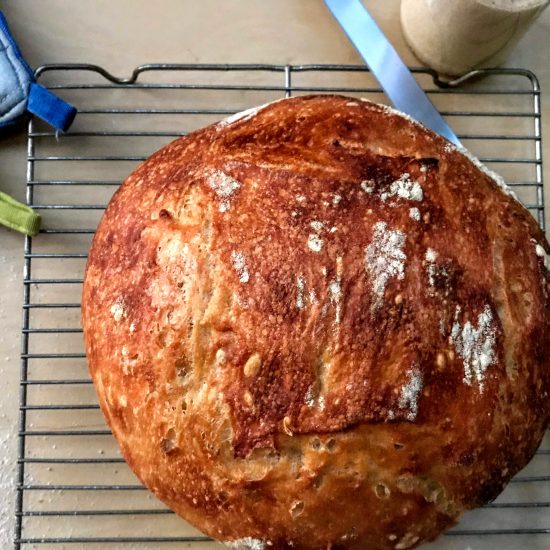
Locate an element on the screen. The height and width of the screenshot is (550, 550). cooling rack is located at coordinates (24, 317).